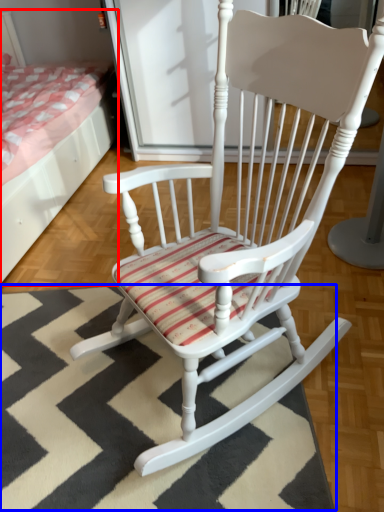
Question: Which of the following is the farthest to the observer, bed (highlighted by a red box) or doormat (highlighted by a blue box)?

Choices:
 (A) bed
 (B) doormat

Answer: (A)